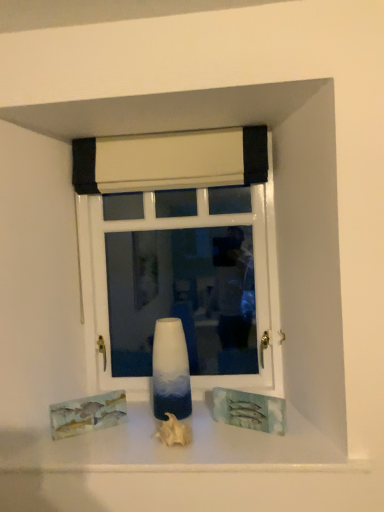
Question: Is point (170, 428) closer or farther from the camera than point (114, 391)?

Choices:
 (A) farther
 (B) closer

Answer: (B)

Question: Is white matte seashell at center, the first art viewed from the right, in front of or behind watercolor paper painting at lower left, arranged as the first art when viewed from the left, in the image?

Choices:
 (A) behind
 (B) front

Answer: (B)

Question: Which is nearer to the white matte seashell at center, the first art viewed from the right?

Choices:
 (A) watercolor paper painting at lower left, arranged as the first art when viewed from the left
 (B) white glossy vase at center
 (C) white fabric curtain at upper center
 (D) white glossy window at center

Answer: (B)

Question: Which is nearer to the white glossy vase at center?

Choices:
 (A) white matte seashell at center, the first art viewed from the right
 (B) white glossy window at center
 (C) white fabric curtain at upper center
 (D) watercolor paper painting at lower left, marked as the 2th art in a right-to-left arrangement

Answer: (A)